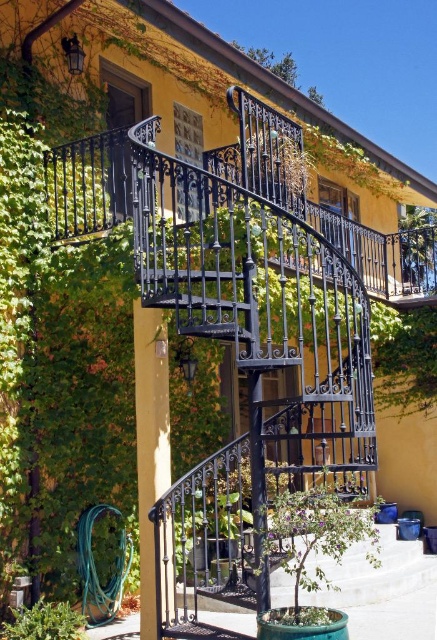
Question: Can you confirm if green leafy plant at center is positioned above green leafy plant at lower left?

Choices:
 (A) yes
 (B) no

Answer: (A)

Question: Can you confirm if green leafy plant at center is positioned to the right of green leafy plant at lower left?

Choices:
 (A) no
 (B) yes

Answer: (B)

Question: Is the position of green leafy plant at center less distant than that of green leafy plant at lower left?

Choices:
 (A) no
 (B) yes

Answer: (B)

Question: Which object appears closest to the camera in this image?

Choices:
 (A) green leafy plant at center
 (B) green leafy plant at lower left

Answer: (A)

Question: Which point is farther from the camera taking this photo?

Choices:
 (A) (323, 547)
 (B) (34, 637)

Answer: (B)